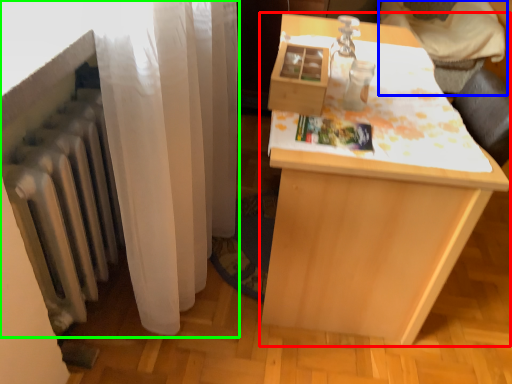
Question: Which object is the farthest from table (highlighted by a red box)? Choose among these: furniture (highlighted by a blue box) or curtain (highlighted by a green box).

Choices:
 (A) furniture
 (B) curtain

Answer: (A)